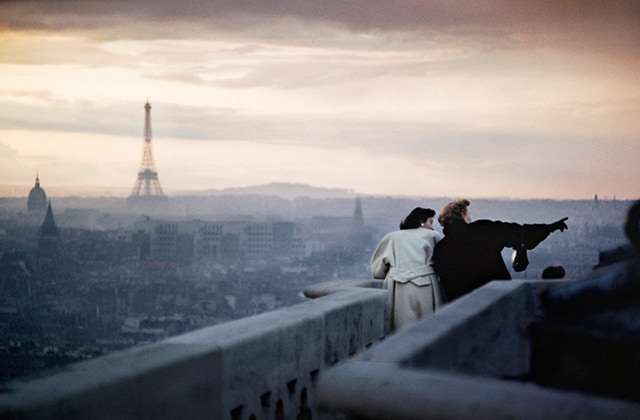
Locate an element on the screen. coat is located at coordinates (408, 251), (488, 235).